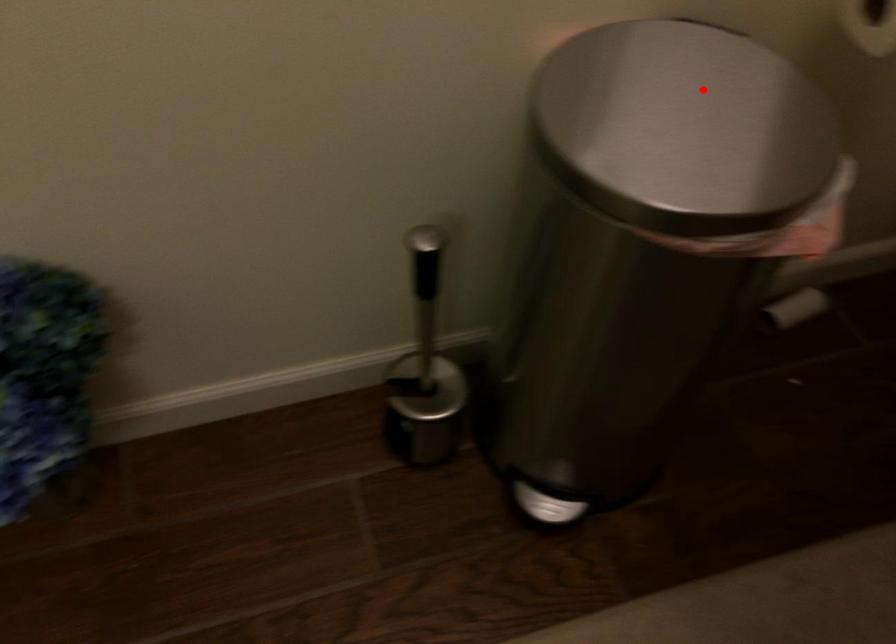
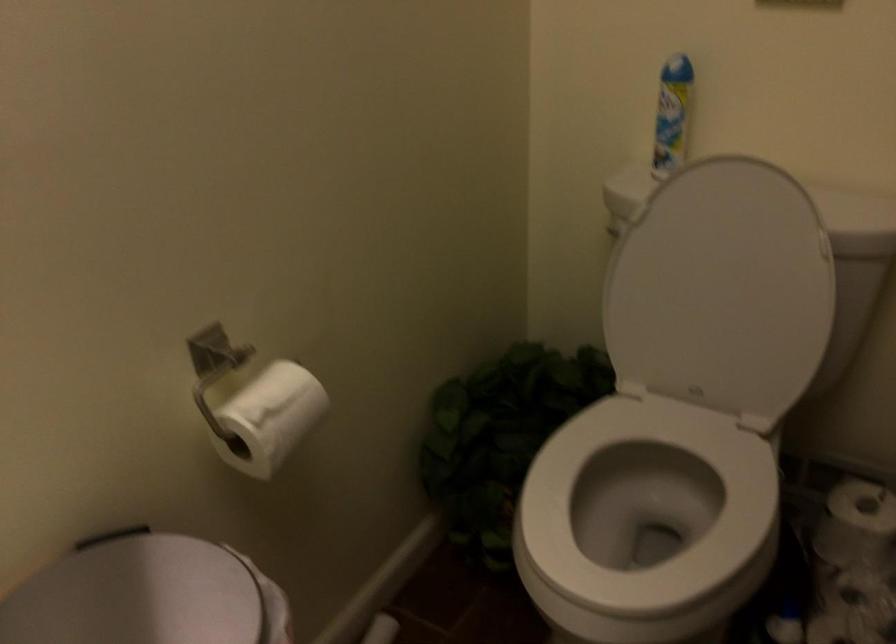
In the second image, find the point that corresponds to the highlighted location in the first image.

(138, 594)